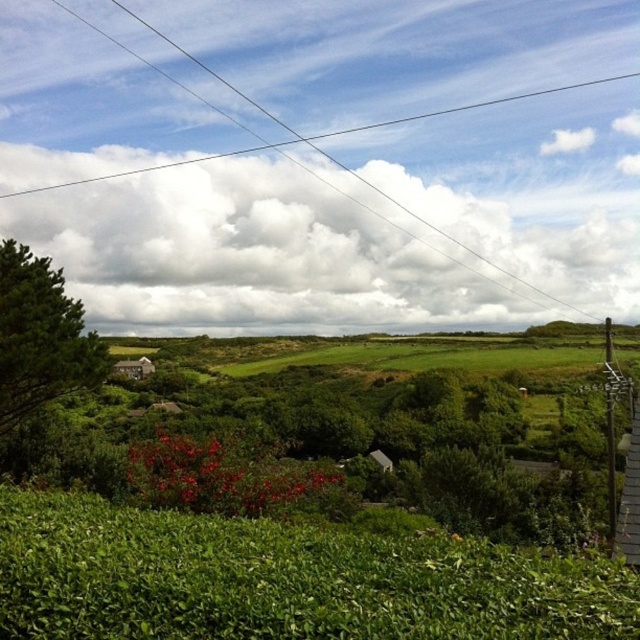
You are a bird flying over the rural landscape. You see the clear wire at upper center and the green leafy tree at left. Which object is closer to you from your perspective?

The clear wire at upper center is closer to you because the green leafy tree at left is behind it.

You are navigating a drone over the rural landscape shown in the image. You need to fly from point A to point B. If point A is at point (182, 225) and point B is at point (72, 339), will you have to fly over any obstacles between them?

Point (182, 225) is behind point (72, 339), so flying from point A to point B would require moving forward towards the closer point. Since the path between them is over open fields and there are no structures or dense vegetation blocking the way, the drone can fly directly between them without obstacles.

You are standing in the rural landscape shown in the image and notice a clear wire at upper center. If you want to reach the wire without moving closer than 180 meters, can you stay where you are?

The clear wire at upper center is 185.51 meters away from the viewer. Since you want to stay at least 180 meters away, you can remain in your current position as the distance is sufficient.